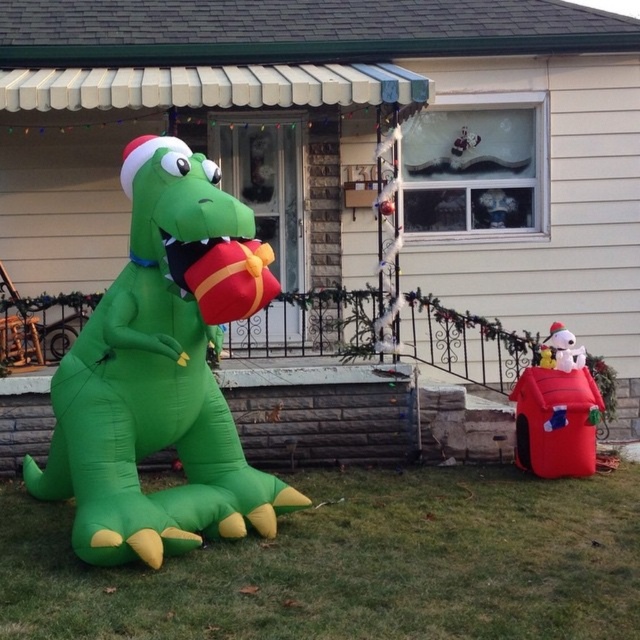
You are standing in front of the house and want to place a new decoration between the two points marked as point (81, 371) and point (552, 412). Which point should you start from to ensure the decoration is closer to the viewer?

You should start from point (81, 371) because it is closer to the viewer than point (552, 412).

You are a delivery robot with a 1 meter wide package. You need to move from the house to the green inflatable dinosaur at lower left and then to the red plush doghouse at lower right. Can you navigate between them without moving the objects?

The distance between the green inflatable dinosaur at lower left and the red plush doghouse at lower right is 79.89 centimeters. Since the package is 1 meter wide, the robot cannot navigate between them as the space is narrower than the package.

You are a child visiting the house for Christmas. You see the green inflatable dinosaur at left and the red plush doghouse at lower right. Which object can you look up to see better?

The green inflatable dinosaur at left is much taller than the red plush doghouse at lower right, so you can look up to see the green inflatable dinosaur at left better.